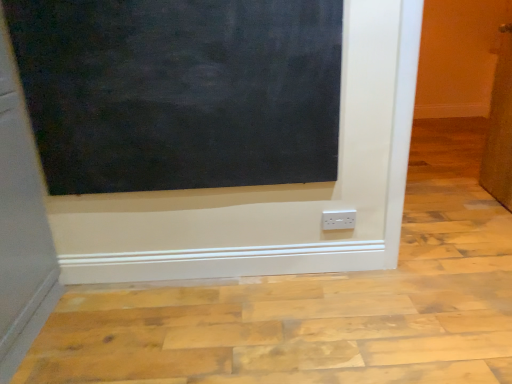
Where is `white plastic power plugs and sockets at lower center`? This screenshot has height=384, width=512. white plastic power plugs and sockets at lower center is located at coordinates (338, 219).

I want to click on black matte board at upper left, so click(180, 91).

Where is `brown textured door at right`? Image resolution: width=512 pixels, height=384 pixels. brown textured door at right is located at coordinates (500, 127).

In terms of height, does brown textured door at right look taller or shorter compared to white plastic power plugs and sockets at lower center?

brown textured door at right is taller than white plastic power plugs and sockets at lower center.

From the image's perspective, which one is positioned lower, brown textured door at right or white plastic power plugs and sockets at lower center?

white plastic power plugs and sockets at lower center is shown below in the image.

Is white plastic power plugs and sockets at lower center located within brown textured door at right?

No, white plastic power plugs and sockets at lower center is not a part of brown textured door at right.

Is point (503, 164) closer or farther from the camera than point (343, 219)?

Point (503, 164).

Can you tell me how much white plastic power plugs and sockets at lower center and black matte board at upper left differ in facing direction?

The angular difference between white plastic power plugs and sockets at lower center and black matte board at upper left is 0.382 degrees.

Would you say white plastic power plugs and sockets at lower center is inside or outside black matte board at upper left?

white plastic power plugs and sockets at lower center lies outside black matte board at upper left.

From the picture: Is white plastic power plugs and sockets at lower center positioned with its back to black matte board at upper left?

That's not correct — white plastic power plugs and sockets at lower center is not looking away from black matte board at upper left.

In the scene shown: Is white plastic power plugs and sockets at lower center in contact with black matte board at upper left?

white plastic power plugs and sockets at lower center is not next to black matte board at upper left, and they're not touching.

Is brown textured door at right directly adjacent to black matte board at upper left?

brown textured door at right and black matte board at upper left are clearly separated.

From the image's perspective, relative to black matte board at upper left, is brown textured door at right above or below?

brown textured door at right is situated higher than black matte board at upper left in the image.

From a real-world perspective, does brown textured door at right sit lower than black matte board at upper left?

Yes, from a real-world perspective, brown textured door at right is below black matte board at upper left.

This screenshot has height=384, width=512. In the image, there is a black matte board at upper left. In order to click on door below it (from a real-world perspective) in this screenshot , I will do `click(500, 127)`.

Do you think white plastic power plugs and sockets at lower center is within brown textured door at right, or outside of it?

white plastic power plugs and sockets at lower center lies outside brown textured door at right.

Considering the sizes of white plastic power plugs and sockets at lower center and brown textured door at right in the image, is white plastic power plugs and sockets at lower center wider or thinner than brown textured door at right?

Clearly, white plastic power plugs and sockets at lower center has less width compared to brown textured door at right.

Is white plastic power plugs and sockets at lower center far away from brown textured door at right?

Yes, white plastic power plugs and sockets at lower center and brown textured door at right are located far from each other.

What's the angular difference between black matte board at upper left and brown textured door at right's facing directions?

5.57 degrees.

Is black matte board at upper left at the left side of brown textured door at right?

Yes.

Is point (264, 30) closer or farther from the camera than point (506, 145)?

Point (264, 30) appears to be closer to the viewer than point (506, 145).

Considering the relative sizes of black matte board at upper left and brown textured door at right in the image provided, is black matte board at upper left thinner than brown textured door at right?

Yes, black matte board at upper left is thinner than brown textured door at right.

Considering the relative positions of black matte board at upper left and white plastic power plugs and sockets at lower center in the image provided, is black matte board at upper left to the left or to the right of white plastic power plugs and sockets at lower center?

Based on their positions, black matte board at upper left is located to the left of white plastic power plugs and sockets at lower center.

In the image, is black matte board at upper left positioned in front of or behind white plastic power plugs and sockets at lower center?

Visually, black matte board at upper left is located in front of white plastic power plugs and sockets at lower center.

Which is in front, point (36, 8) or point (339, 221)?

Positioned in front is point (36, 8).

From the image's perspective, is black matte board at upper left beneath white plastic power plugs and sockets at lower center?

Actually, black matte board at upper left appears above white plastic power plugs and sockets at lower center in the image.

Find the location of a particular element. The height and width of the screenshot is (384, 512). power plugs and sockets lying on the left of brown textured door at right is located at coordinates point(338,219).

The height and width of the screenshot is (384, 512). Find the location of `bulletin board above the white plastic power plugs and sockets at lower center (from the image's perspective)`. bulletin board above the white plastic power plugs and sockets at lower center (from the image's perspective) is located at coordinates (180, 91).

Consider the image. Looking at the image, which one is located further to white plastic power plugs and sockets at lower center, black matte board at upper left or brown textured door at right?

brown textured door at right lies further to white plastic power plugs and sockets at lower center than the other object.

Estimate the real-world distances between objects in this image. Which object is closer to brown textured door at right, white plastic power plugs and sockets at lower center or black matte board at upper left?

white plastic power plugs and sockets at lower center lies closer to brown textured door at right than the other object.

Looking at the image, which one is located closer to black matte board at upper left, white plastic power plugs and sockets at lower center or brown textured door at right?

Among the two, white plastic power plugs and sockets at lower center is located nearer to black matte board at upper left.

Estimate the real-world distances between objects in this image. Which object is closer to white plastic power plugs and sockets at lower center, brown textured door at right or black matte board at upper left?

black matte board at upper left is positioned closer to the anchor white plastic power plugs and sockets at lower center.

In the scene shown: Considering their positions, is black matte board at upper left positioned further to brown textured door at right than white plastic power plugs and sockets at lower center?

Based on the image, black matte board at upper left appears to be further to brown textured door at right.

Looking at the image, which one is located further to black matte board at upper left, brown textured door at right or white plastic power plugs and sockets at lower center?

brown textured door at right lies further to black matte board at upper left than the other object.

Locate an element on the screen. Image resolution: width=512 pixels, height=384 pixels. power plugs and sockets between black matte board at upper left and brown textured door at right from left to right is located at coordinates (338, 219).